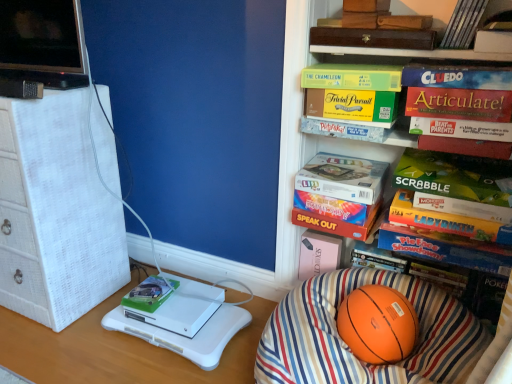
This screenshot has width=512, height=384. Identify the location of blank space situated above mattel board game at center, the third book when ordered from top to bottom (from a real-world perspective). (346, 163).